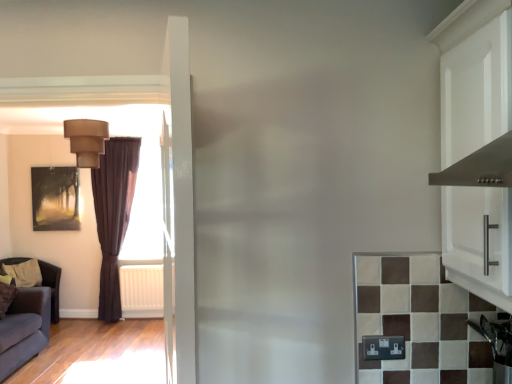
Question: From a real-world perspective, is white plastic radiator at left located beneath stainless steel oven at lower right?

Choices:
 (A) no
 (B) yes

Answer: (B)

Question: Considering the relative sizes of white plastic radiator at left and stainless steel oven at lower right in the image provided, is white plastic radiator at left taller than stainless steel oven at lower right?

Choices:
 (A) no
 (B) yes

Answer: (B)

Question: From a real-world perspective, is white plastic radiator at left on top of stainless steel oven at lower right?

Choices:
 (A) yes
 (B) no

Answer: (B)

Question: Are white plastic radiator at left and stainless steel oven at lower right far apart?

Choices:
 (A) no
 (B) yes

Answer: (B)

Question: Can you confirm if white plastic radiator at left is bigger than stainless steel oven at lower right?

Choices:
 (A) no
 (B) yes

Answer: (B)

Question: From their relative heights in the image, would you say dark brown leather armchair at left is taller or shorter than white plastic radiator at left?

Choices:
 (A) tall
 (B) short

Answer: (A)

Question: Considering the positions of dark brown leather armchair at left and white plastic radiator at left in the image, is dark brown leather armchair at left bigger or smaller than white plastic radiator at left?

Choices:
 (A) big
 (B) small

Answer: (A)

Question: From the image's perspective, is dark brown leather armchair at left above or below white plastic radiator at left?

Choices:
 (A) below
 (B) above

Answer: (B)

Question: Is point (8, 258) positioned closer to the camera than point (135, 279)?

Choices:
 (A) closer
 (B) farther

Answer: (B)

Question: Is point (77, 160) positioned closer to the camera than point (134, 307)?

Choices:
 (A) farther
 (B) closer

Answer: (B)

Question: Considering the relative positions of matte beige lampshade at upper left and white plastic radiator at left in the image provided, is matte beige lampshade at upper left to the left or to the right of white plastic radiator at left?

Choices:
 (A) right
 (B) left

Answer: (A)

Question: From a real-world perspective, relative to white plastic radiator at left, is matte beige lampshade at upper left vertically above or below?

Choices:
 (A) below
 (B) above

Answer: (B)

Question: Is matte beige lampshade at upper left taller or shorter than white plastic radiator at left?

Choices:
 (A) tall
 (B) short

Answer: (B)

Question: Looking at the image, does stainless steel oven at lower right seem bigger or smaller compared to brown velvet curtain at left?

Choices:
 (A) small
 (B) big

Answer: (A)

Question: Relative to brown velvet curtain at left, is stainless steel oven at lower right in front or behind?

Choices:
 (A) behind
 (B) front

Answer: (B)